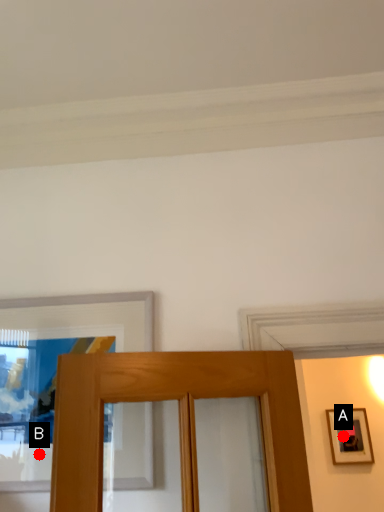
Question: Two points are circled on the image, labeled by A and B beside each circle. Which point is farther from the camera taking this photo?

Choices:
 (A) A is further
 (B) B is further

Answer: (A)